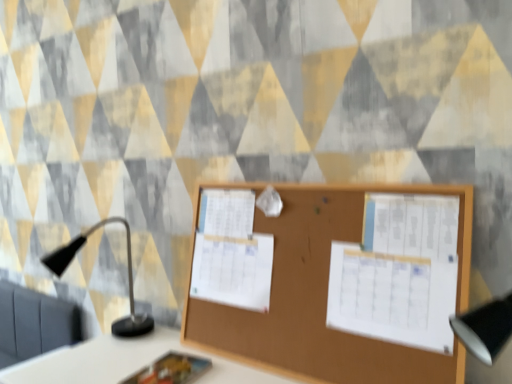
Question: Considering the relative sizes of white paper at center, which is the 2th poster in front-to-back order, and matte plastic notebook at lower center in the image provided, is white paper at center, which is the 2th poster in front-to-back order, taller than matte plastic notebook at lower center?

Choices:
 (A) yes
 (B) no

Answer: (A)

Question: Is white paper at center, which is the 2th poster in front-to-back order, smaller than matte plastic notebook at lower center?

Choices:
 (A) yes
 (B) no

Answer: (B)

Question: Is white paper at center, the second poster viewed from the right, located outside matte plastic notebook at lower center?

Choices:
 (A) yes
 (B) no

Answer: (A)

Question: Is white paper at center, which is the 2th poster in front-to-back order, placed right next to matte plastic notebook at lower center?

Choices:
 (A) no
 (B) yes

Answer: (A)

Question: From the image's perspective, would you say white paper at center, the second poster viewed from the right, is positioned over matte plastic notebook at lower center?

Choices:
 (A) no
 (B) yes

Answer: (B)

Question: Considering the positions of white paper at center, which is the 2th poster in front-to-back order, and brown wood bulletin board at center in the image, is white paper at center, which is the 2th poster in front-to-back order, wider or thinner than brown wood bulletin board at center?

Choices:
 (A) thin
 (B) wide

Answer: (A)

Question: Is point (228, 271) positioned closer to the camera than point (310, 349)?

Choices:
 (A) closer
 (B) farther

Answer: (B)

Question: From a real-world perspective, is white paper at center, the 1th poster viewed from the left, positioned above or below brown wood bulletin board at center?

Choices:
 (A) below
 (B) above

Answer: (A)

Question: Considering the positions of white paper at center, the second poster viewed from the right, and brown wood bulletin board at center in the image, is white paper at center, the second poster viewed from the right, bigger or smaller than brown wood bulletin board at center?

Choices:
 (A) small
 (B) big

Answer: (A)

Question: In terms of size, does white paper at center, the first poster from the front, appear bigger or smaller than white paper at center, the 1th poster viewed from the left?

Choices:
 (A) small
 (B) big

Answer: (A)

Question: Which is correct: white paper at center, the second poster viewed from the back, is inside white paper at center, which is the 2th poster in front-to-back order, or outside of it?

Choices:
 (A) outside
 (B) inside

Answer: (A)

Question: From a real-world perspective, relative to white paper at center, the 1th poster viewed from the left, is white paper at center, which is the first poster from right to left, vertically above or below?

Choices:
 (A) below
 (B) above

Answer: (B)

Question: Considering the positions of point (353, 286) and point (223, 269), is point (353, 286) closer or farther from the camera than point (223, 269)?

Choices:
 (A) farther
 (B) closer

Answer: (B)

Question: From a real-world perspective, relative to white paper at center, the 1th poster viewed from the left, is black matte table lamp at left vertically above or below?

Choices:
 (A) below
 (B) above

Answer: (A)

Question: Based on their positions, is black matte table lamp at left located to the left or right of white paper at center, which is the 2th poster in front-to-back order?

Choices:
 (A) left
 (B) right

Answer: (A)